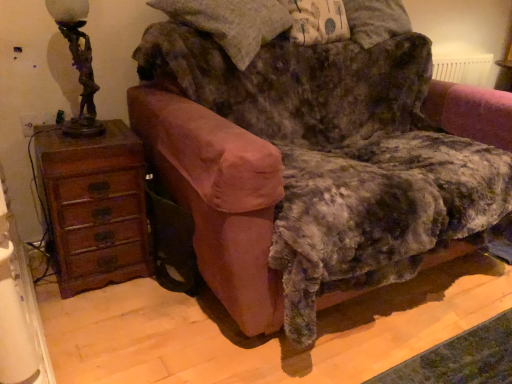
Locate an element on the screen. vacant space in between velvet pink armchair at center and brown wooden chest of drawers at left is located at coordinates tap(147, 322).